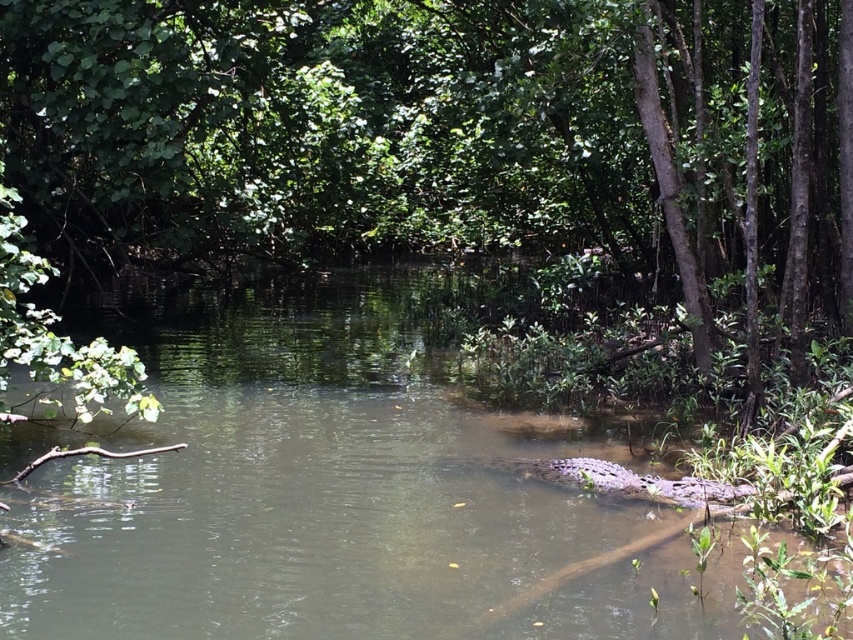
Question: Observing the image, what is the correct spatial positioning of green leafy tree at center in reference to brown muddy stream at center?

Choices:
 (A) right
 (B) left

Answer: (A)

Question: Does green leafy tree at center have a smaller size compared to brown muddy stream at center?

Choices:
 (A) no
 (B) yes

Answer: (A)

Question: Is green leafy tree at center smaller than brown muddy stream at center?

Choices:
 (A) yes
 (B) no

Answer: (B)

Question: Which object is farther from the camera taking this photo?

Choices:
 (A) brown muddy stream at center
 (B) green leafy tree at center

Answer: (B)